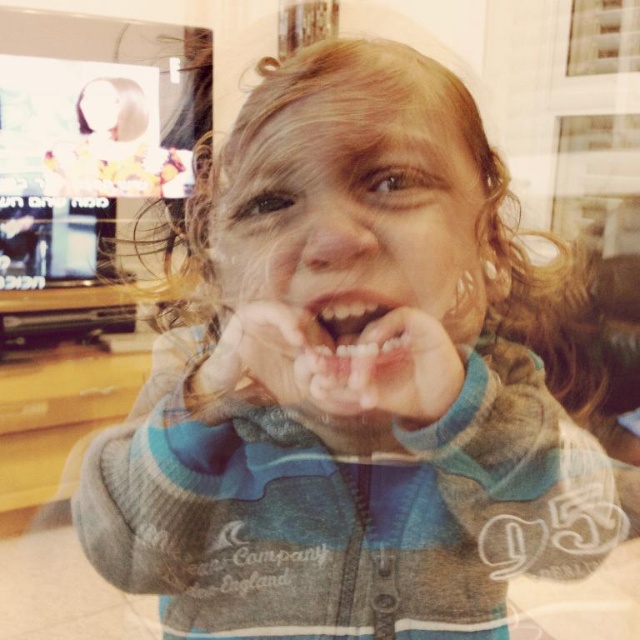
Based on the scene description, if you were to draw a line from the top of the smooth skin face at center to its bottom, how would its height compare to the height of the white matte teeth at center?

The smooth skin face at center is much taller than the white matte teeth at center according to the description.

Based on the scene described, which object, the smooth skin face at center or the smooth pink lips at center, occupies a greater area in the image?

The smooth skin face at center has a larger size compared to the smooth pink lips at center, so it occupies a greater area in the image.

The child in the image has a smooth skin face at center and a matte skin hand at center. Which of these two body parts is closer to the camera?

The smooth skin face at center is closer to the camera because it is in front of the matte skin hand at center.